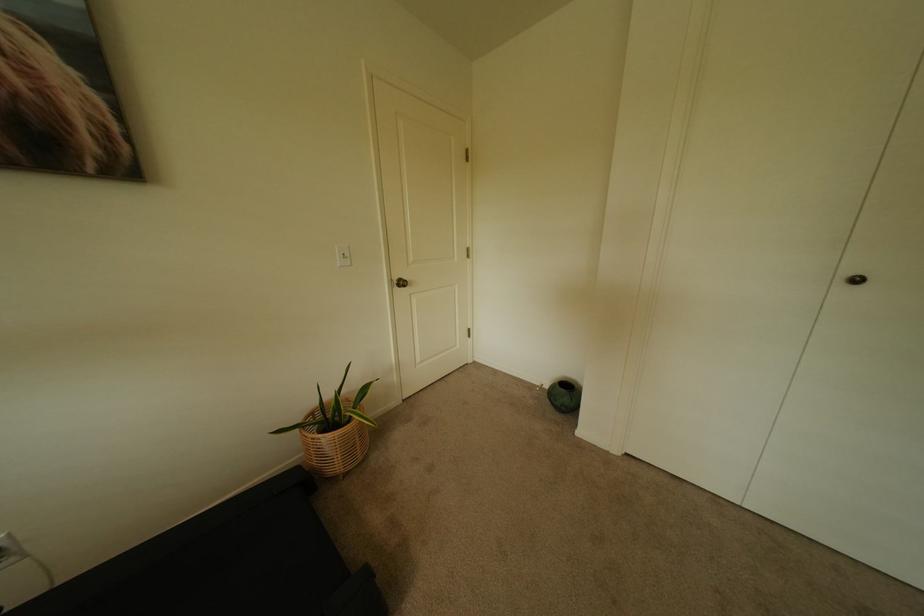
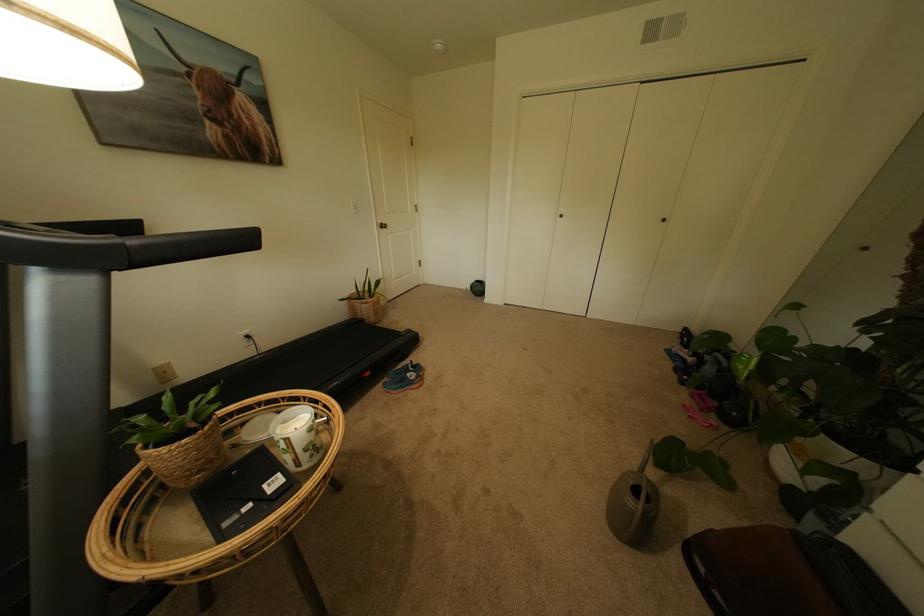
Find the pixel in the second image that matches (347,458) in the first image.

(382, 314)